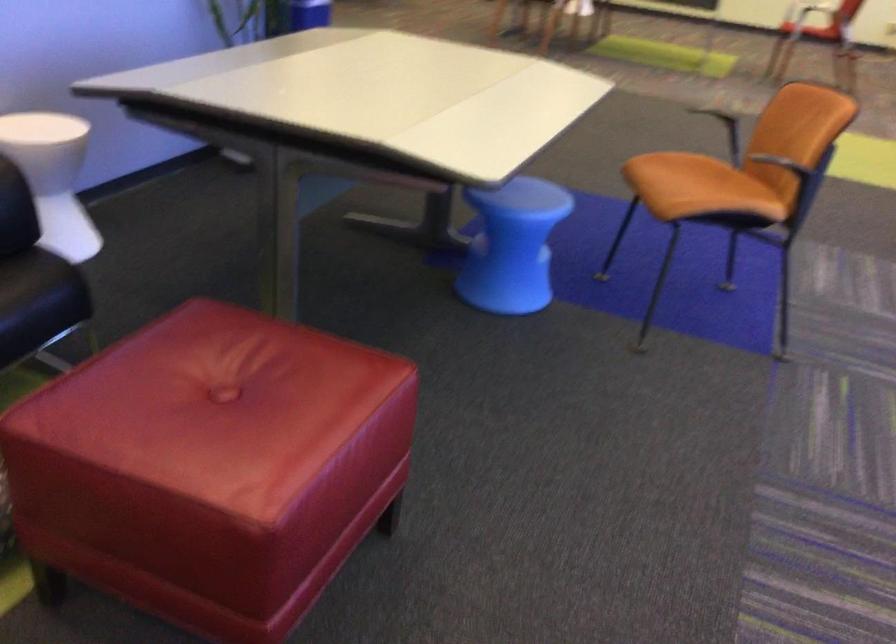
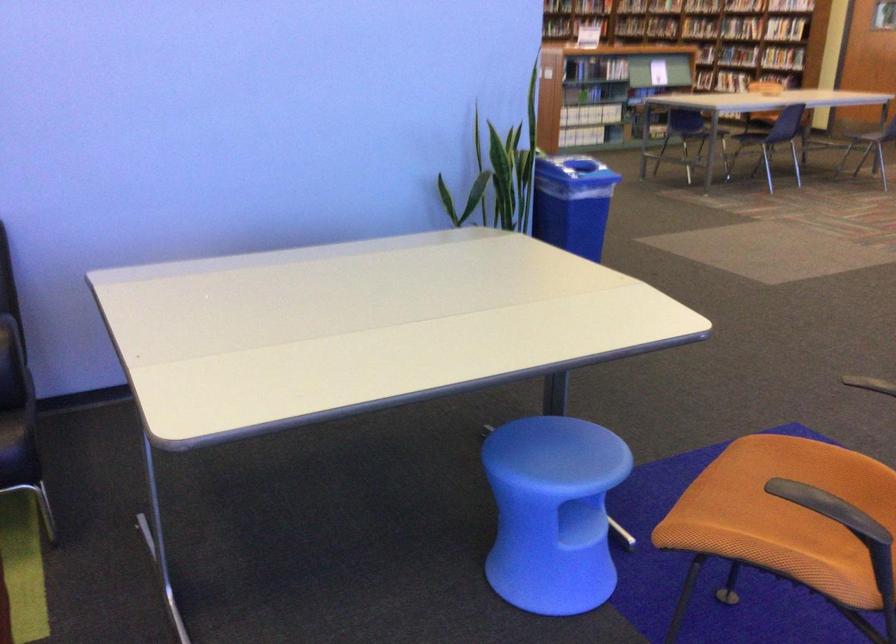
Question: I am providing you with two images of the same scene from different viewpoints. Please identify which objects are invisible in image2.

Choices:
 (A) white plastic stool
 (B) orange ceramic mug
 (C) book on shelf
 (D) blue chair sitting surface

Answer: (A)